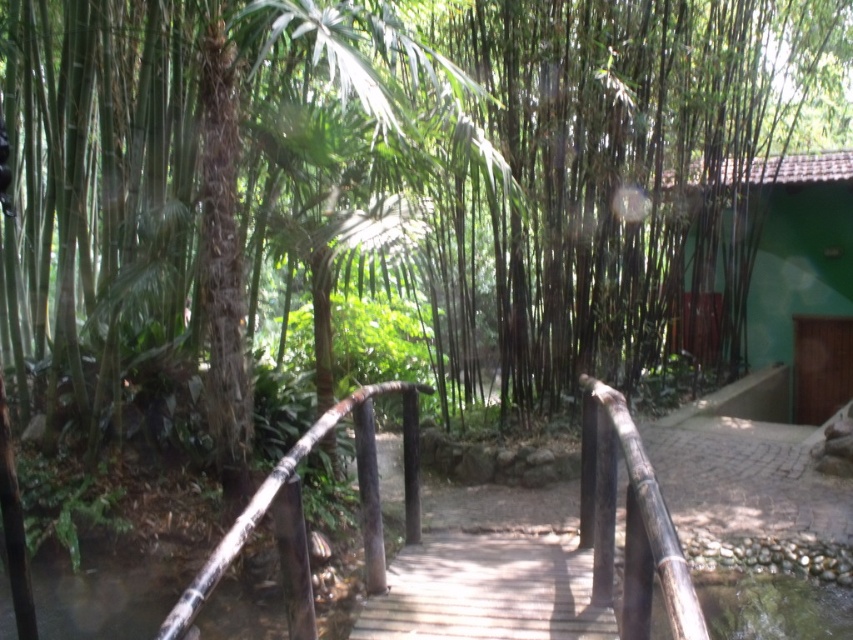
Does green matte hut at right come in front of brown rough bamboo rail at center?

No, it is not.

Is point (775, 198) behind point (636, 589)?

Yes, it is.

Where is `green matte hut at right`? green matte hut at right is located at coordinates (799, 252).

Is green matte hut at right below white glossy rail at center?

Actually, green matte hut at right is above white glossy rail at center.

Between green matte hut at right and white glossy rail at center, which one has less height?

white glossy rail at center

Locate an element on the screen. The width and height of the screenshot is (853, 640). green matte hut at right is located at coordinates (799, 252).

Based on the photo, between brown rough bamboo rail at center and white glossy rail at center, which one has more height?

With more height is brown rough bamboo rail at center.

Between brown rough bamboo rail at center and white glossy rail at center, which one appears on the left side from the viewer's perspective?

Positioned to the left is white glossy rail at center.

Between point (635, 563) and point (338, 413), which one is positioned in front?

Point (635, 563) is in front.

The width and height of the screenshot is (853, 640). I want to click on brown rough bamboo rail at center, so click(631, 522).